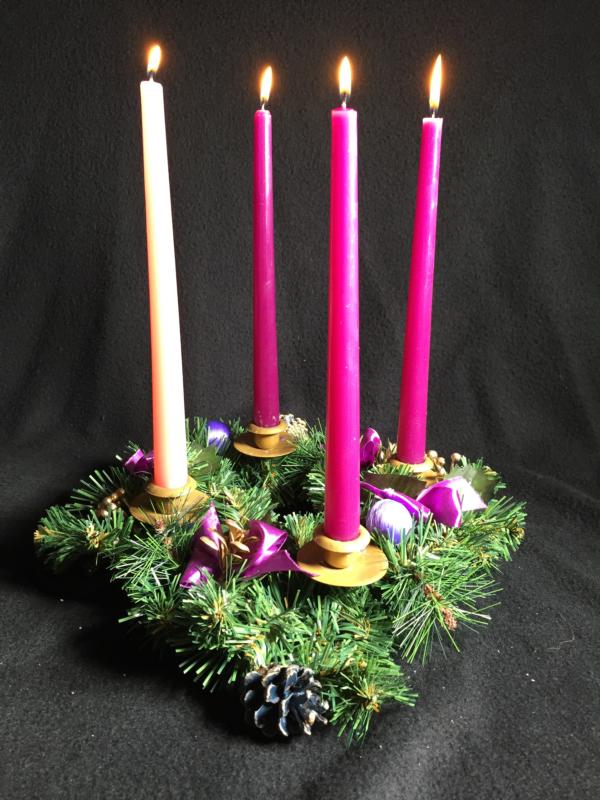
Locate an element on the screen. The width and height of the screenshot is (600, 800). pink candle is located at coordinates (264, 364), (350, 396), (415, 386), (342, 422).